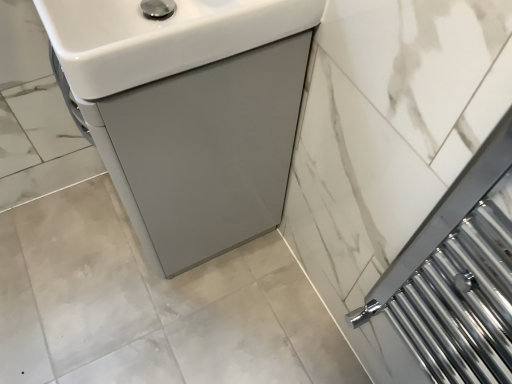
Question: Does point (155, 162) appear closer or farther from the camera than point (230, 6)?

Choices:
 (A) closer
 (B) farther

Answer: (B)

Question: From the image's perspective, relative to white glossy sink at upper left, which ranks as the 2th sink in back-to-front order, is white glossy sink at center, the 2th sink when ordered from front to back, above or below?

Choices:
 (A) above
 (B) below

Answer: (B)

Question: Considering the positions of white glossy sink at center, the first sink viewed from the back, and white glossy sink at upper left, which ranks as the 2th sink in back-to-front order, in the image, is white glossy sink at center, the first sink viewed from the back, taller or shorter than white glossy sink at upper left, which ranks as the 2th sink in back-to-front order,?

Choices:
 (A) short
 (B) tall

Answer: (B)

Question: Considering the positions of white glossy sink at upper left, arranged as the 1th sink when viewed from the front, and white glossy sink at center, the first sink viewed from the back, in the image, is white glossy sink at upper left, arranged as the 1th sink when viewed from the front, bigger or smaller than white glossy sink at center, the first sink viewed from the back,?

Choices:
 (A) big
 (B) small

Answer: (B)

Question: Would you say white glossy sink at upper left, arranged as the 1th sink when viewed from the front, is to the left or to the right of white glossy sink at center, the first sink viewed from the back, in the picture?

Choices:
 (A) left
 (B) right

Answer: (B)

Question: Looking at their shapes, would you say white glossy sink at upper left, which ranks as the 2th sink in back-to-front order, is wider or thinner than white glossy sink at center, the first sink viewed from the back?

Choices:
 (A) wide
 (B) thin

Answer: (B)

Question: From a real-world perspective, is white glossy sink at upper left, arranged as the 1th sink when viewed from the front, physically located above or below white glossy sink at center, the first sink viewed from the back?

Choices:
 (A) above
 (B) below

Answer: (A)